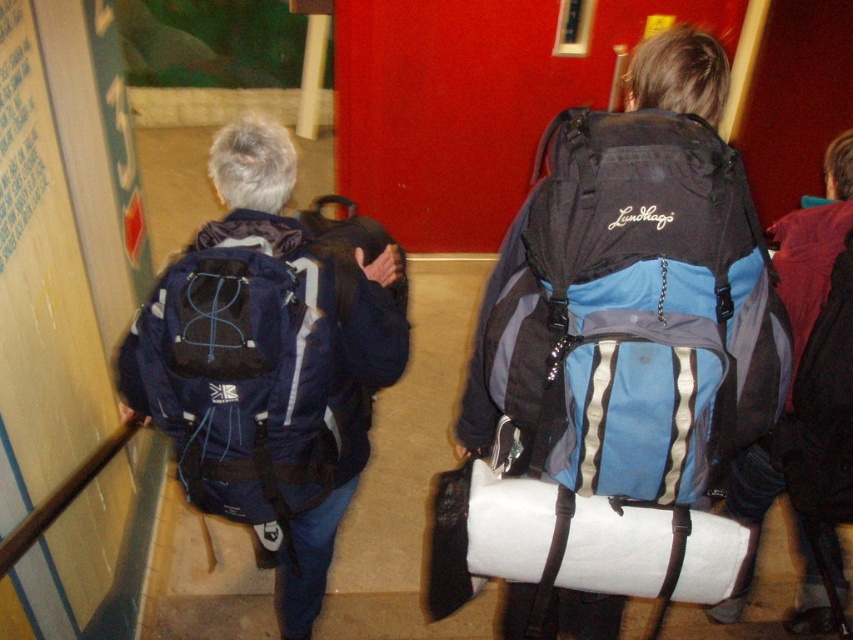
Question: Does matte blue backpack at left come behind navy blue fabric backpack at left?

Choices:
 (A) yes
 (B) no

Answer: (A)

Question: Which point appears farthest from the camera in this image?

Choices:
 (A) click(x=675, y=403)
 (B) click(x=749, y=493)
 (C) click(x=276, y=228)
 (D) click(x=329, y=376)

Answer: (B)

Question: Among these points, which one is farthest from the camera?

Choices:
 (A) (x=851, y=136)
 (B) (x=294, y=454)
 (C) (x=728, y=278)

Answer: (A)

Question: Is matte black backpack at center behind blue fabric backpack at center?

Choices:
 (A) yes
 (B) no

Answer: (B)

Question: Is matte black backpack at center to the right of navy blue fabric backpack at left from the viewer's perspective?

Choices:
 (A) yes
 (B) no

Answer: (A)

Question: Which point appears farthest from the camera in this image?

Choices:
 (A) (212, 458)
 (B) (608, 168)
 (C) (749, 480)
 (D) (173, 276)

Answer: (C)